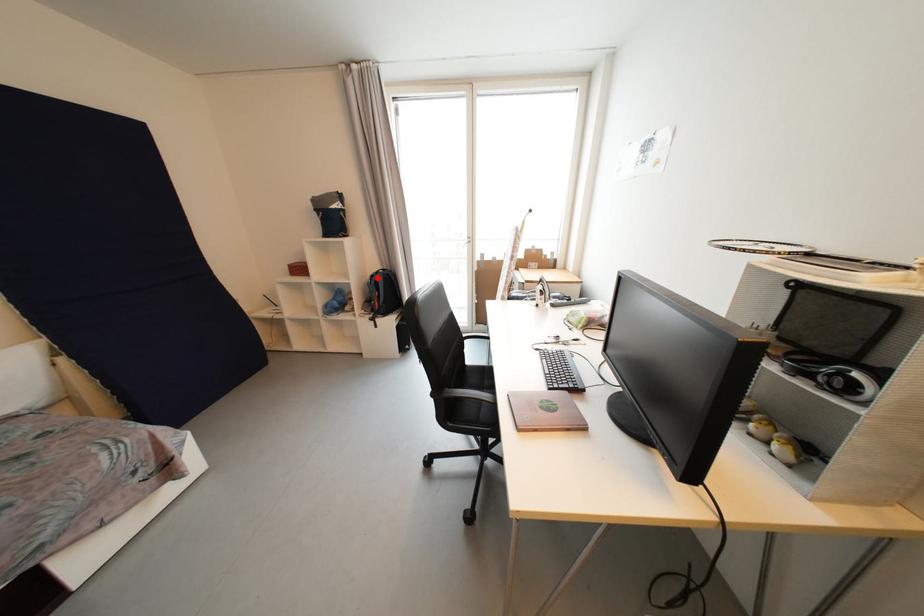
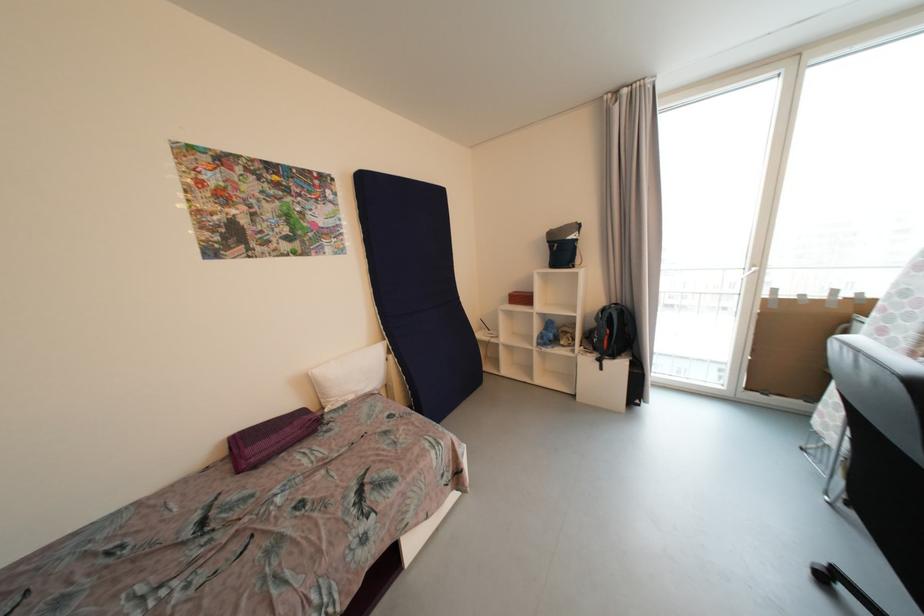
In the second image, find the point that corresponds to the highlighted location in the first image.

(608, 312)